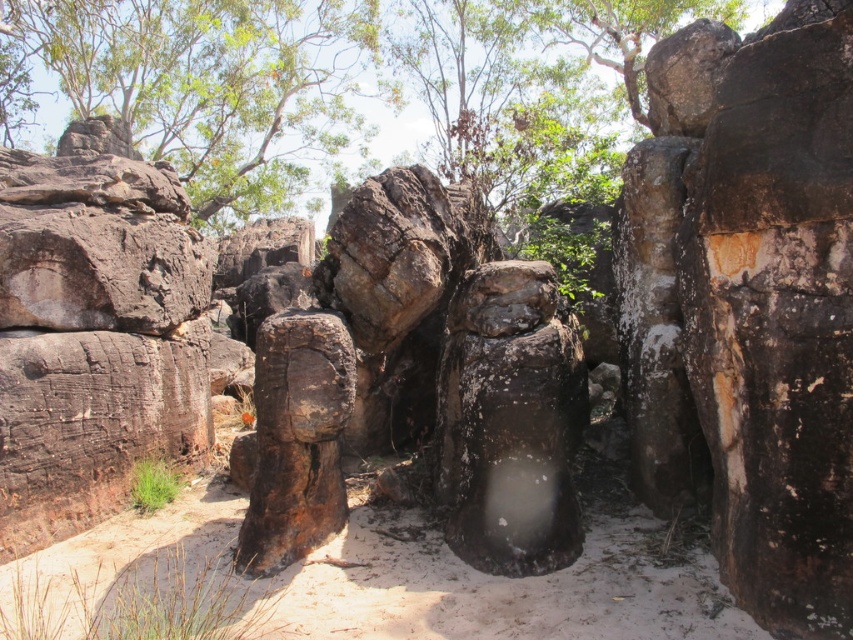
You are standing at the edge of the scene and want to place a small flag exactly at the center of the white sandy ground at center. According to the coordinates provided, where should you place the flag?

The white sandy ground at center is located at point [354,584], so you should place the flag at those coordinates to mark its center.

You are standing on the white sandy ground at center and looking towards the green leafy tree at upper left. Which object is closer to you?

The white sandy ground at center is closer to you because it is in front of the green leafy tree at upper left.

You are standing in the middle of the dry, arid environment shown in the image. There is a point labeled as point (354, 584) which is the white sandy ground at center. If you want to walk towards the white sandy ground at center, which direction should you face?

You should face the direction of the white sandy ground at center, which is located at point (354, 584). Since you are currently in the middle of the dry, arid environment, facing towards that point will guide you correctly.